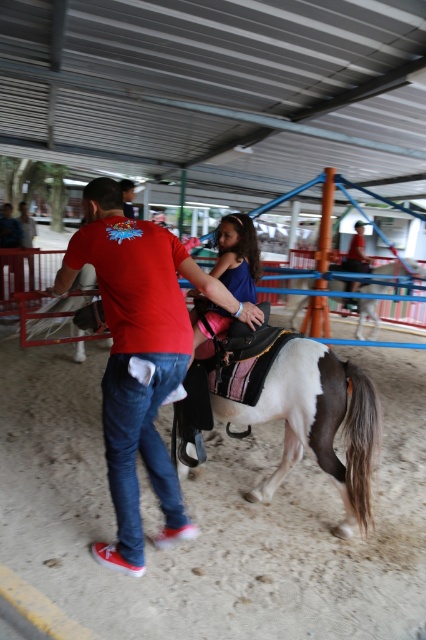
Question: Based on their relative distances, which object is farther from the red cotton t-shirt at center?

Choices:
 (A) blue cotton shirt at center
 (B) white matte horse at center

Answer: (B)

Question: Which point is farther to the camera?

Choices:
 (A) (97, 604)
 (B) (339, 300)
 (C) (108, 426)

Answer: (B)

Question: Which object is closer to the camera taking this photo?

Choices:
 (A) red cotton t-shirt at center
 (B) brown sandy dirt track at center

Answer: (B)

Question: Can you confirm if blue cotton shirt at center is wider than white matte horse at center?

Choices:
 (A) yes
 (B) no

Answer: (B)

Question: Is brown sandy dirt track at center smaller than red cotton t-shirt at center?

Choices:
 (A) no
 (B) yes

Answer: (A)

Question: From the image, what is the correct spatial relationship of red cotton t-shirt at center in relation to blue cotton shirt at center?

Choices:
 (A) left
 (B) right

Answer: (A)